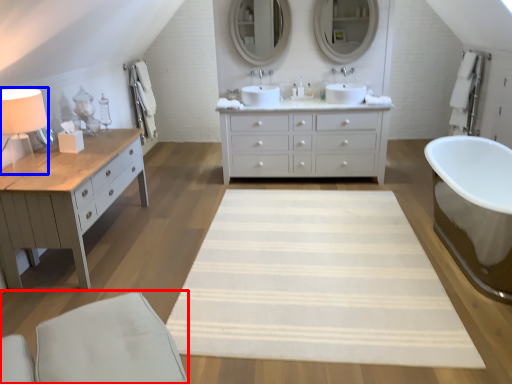
Question: Which object appears farthest to the camera in this image, swivel chair (highlighted by a red box) or table lamp (highlighted by a blue box)?

Choices:
 (A) swivel chair
 (B) table lamp

Answer: (B)